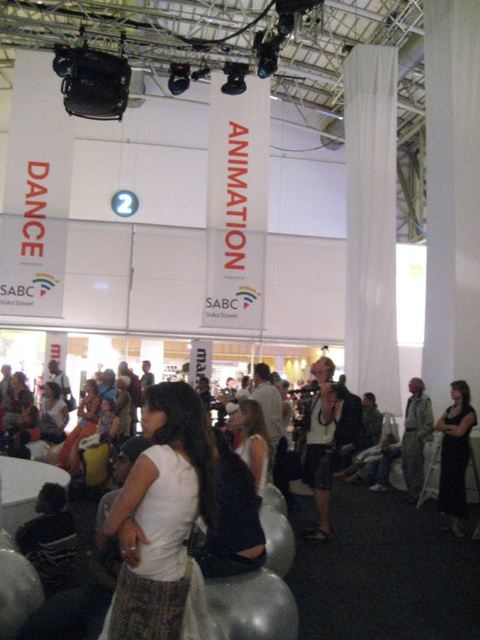
You are an event planner standing in the center of the stage. You need to adjust the lighting for the white fabric dress at center and the matte white dress at center. Which dress should you focus on first if you want to start with the one that is nearest to the front of the stage?

The white fabric dress at center is closer to the viewer than matte white dress at center, so you should focus on the white fabric dress at center first since it is nearer to the front of the stage.